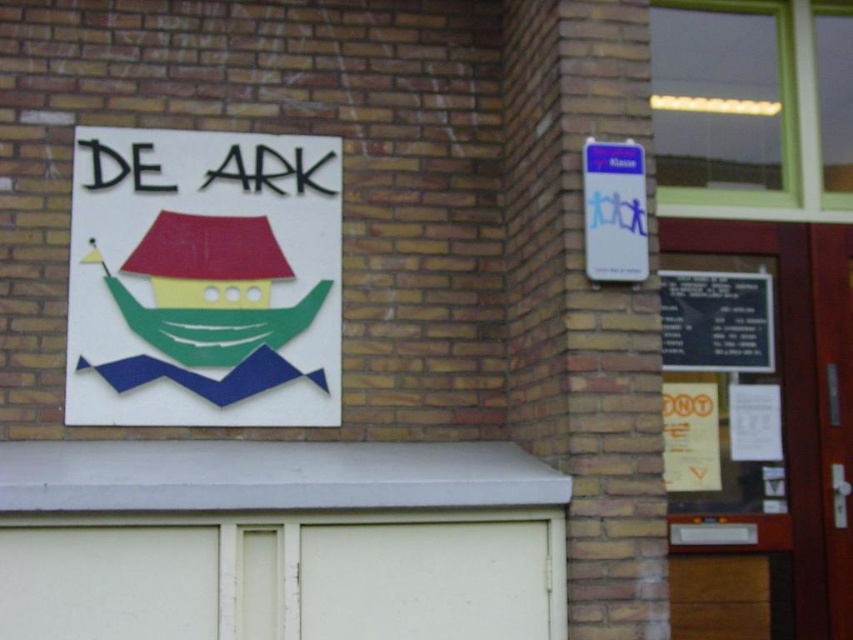
Question: Which is nearer to the matte plastic sign at upper left?

Choices:
 (A) white matte garage door at lower center
 (B) black matte signboard at right
 (C) blue paper sign at upper right

Answer: (A)

Question: Can you confirm if matte plastic sign at upper left is smaller than blue paper sign at upper right?

Choices:
 (A) no
 (B) yes

Answer: (A)

Question: Where is matte plastic sign at upper left located in relation to white matte garage door at lower center in the image?

Choices:
 (A) right
 (B) left

Answer: (B)

Question: Which point is closer to the camera?

Choices:
 (A) matte plastic sign at upper left
 (B) blue paper sign at upper right

Answer: (B)

Question: Estimate the real-world distances between objects in this image. Which object is farther from the white matte garage door at lower center?

Choices:
 (A) blue paper sign at upper right
 (B) matte plastic sign at upper left
 (C) black matte signboard at right

Answer: (C)

Question: Is white matte garage door at lower center above black matte signboard at right?

Choices:
 (A) no
 (B) yes

Answer: (A)